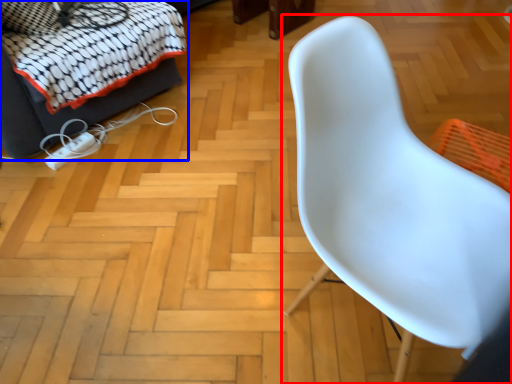
Question: Which point is further to the camera, chair (highlighted by a red box) or furniture (highlighted by a blue box)?

Choices:
 (A) chair
 (B) furniture

Answer: (B)